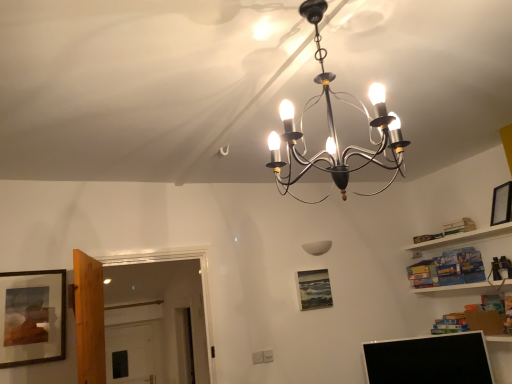
Question: Is black glossy computer monitor at lower right positioned with its back to metallic chandelier at center, acting as the 1th lamp starting from the top?

Choices:
 (A) no
 (B) yes

Answer: (A)

Question: Is black glossy computer monitor at lower right smaller than metallic chandelier at center, the second lamp viewed from the back?

Choices:
 (A) yes
 (B) no

Answer: (A)

Question: From a real-world perspective, is black glossy computer monitor at lower right positioned over metallic chandelier at center, marked as the 1th lamp in a front-to-back arrangement, based on gravity?

Choices:
 (A) no
 (B) yes

Answer: (A)

Question: Considering the relative positions of black glossy computer monitor at lower right and metallic chandelier at center, acting as the 1th lamp starting from the top, in the image provided, is black glossy computer monitor at lower right in front of metallic chandelier at center, acting as the 1th lamp starting from the top,?

Choices:
 (A) no
 (B) yes

Answer: (A)

Question: Is black glossy computer monitor at lower right to the left of metallic chandelier at center, acting as the 1th lamp starting from the top, from the viewer's perspective?

Choices:
 (A) no
 (B) yes

Answer: (A)

Question: In the image, is wooden-framed painting at left, which is the 1th picture frame in left-to-right order, positioned in front of or behind black glossy computer monitor at lower right?

Choices:
 (A) behind
 (B) front

Answer: (B)

Question: Considering the positions of wooden-framed painting at left, placed as the 2th picture frame when sorted from bottom to top, and black glossy computer monitor at lower right in the image, is wooden-framed painting at left, placed as the 2th picture frame when sorted from bottom to top, wider or thinner than black glossy computer monitor at lower right?

Choices:
 (A) thin
 (B) wide

Answer: (A)

Question: Visually, is wooden-framed painting at left, the 2th picture frame viewed from the top, positioned to the left or to the right of black glossy computer monitor at lower right?

Choices:
 (A) right
 (B) left

Answer: (B)

Question: From a real-world perspective, is wooden-framed painting at left, the 3th picture frame from the right, physically located above or below black glossy computer monitor at lower right?

Choices:
 (A) above
 (B) below

Answer: (A)

Question: Is matte black picture frame at center, marked as the third picture frame in a top-to-bottom arrangement, bigger or smaller than wooden-framed painting at left, placed as the 2th picture frame when sorted from bottom to top?

Choices:
 (A) big
 (B) small

Answer: (B)

Question: Is matte black picture frame at center, marked as the third picture frame in a top-to-bottom arrangement, wider or thinner than wooden-framed painting at left, the 3th picture frame from the right?

Choices:
 (A) wide
 (B) thin

Answer: (A)

Question: Is matte black picture frame at center, acting as the second picture frame starting from the left, inside or outside of wooden-framed painting at left, placed as the 3th picture frame when sorted from back to front?

Choices:
 (A) inside
 (B) outside

Answer: (B)

Question: Is point (323, 304) closer or farther from the camera than point (31, 286)?

Choices:
 (A) farther
 (B) closer

Answer: (A)

Question: Considering the positions of black matte picture frame at upper right, which is the first picture frame from right to left, and white matte wall lamp at center, acting as the 2th lamp starting from the front, in the image, is black matte picture frame at upper right, which is the first picture frame from right to left, wider or thinner than white matte wall lamp at center, acting as the 2th lamp starting from the front,?

Choices:
 (A) wide
 (B) thin

Answer: (A)

Question: From the image's perspective, is black matte picture frame at upper right, the 2th picture frame in the back-to-front sequence, located above or below white matte wall lamp at center, acting as the 2th lamp starting from the front?

Choices:
 (A) below
 (B) above

Answer: (B)